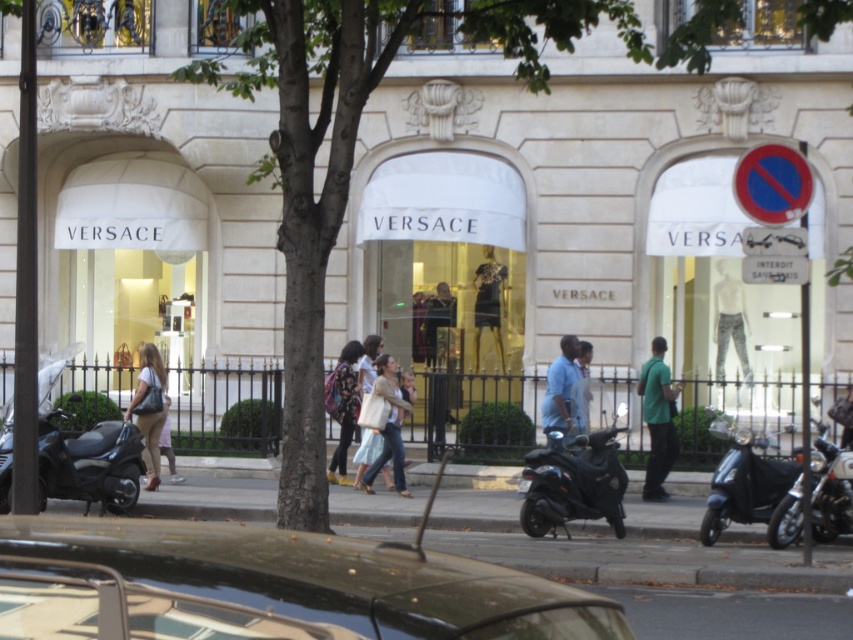
Consider the image. You are a photographer standing on the sidewalk in front of the Versace store. You want to take a photo of the Versace storefront without any obstructions. The green leafy tree at center and the light beige pants at center are in your way. Which object would you need to move further to the side to get a clear shot?

The green leafy tree at center has a larger width than the light beige pants at center, so moving the green leafy tree at center further to the side would be necessary to clear the view since it occupies more space.

You are a delivery person approaching the Versace store and see the shiny black scooter at lower right and the green matte shirt at center. Which object is nearer to you as you walk towards the store?

The shiny black scooter at lower right is closer to the viewer than the green matte shirt at center, so it is nearer to you as you walk towards the store.

You are a delivery person who needs to park your vehicle between the shiny black scooter at center and the shiny chrome motorcycle at lower right. Which side should you park your vehicle on to be between them?

You should park your vehicle on the right side of the shiny black scooter at center because it is positioned to the left of the shiny chrome motorcycle at lower right, so placing your vehicle to its right would place you between both vehicles.